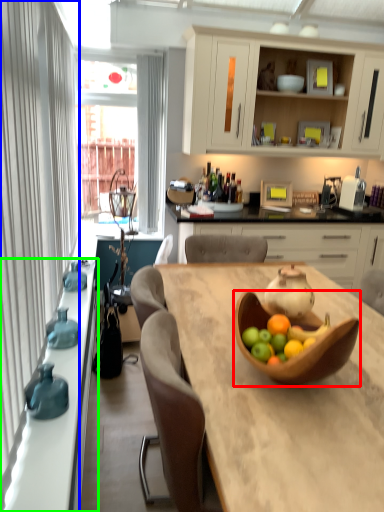
Question: Which is nearer to the tableware (highlighted by a red box)? curtain (highlighted by a blue box) or countertop (highlighted by a green box).

Choices:
 (A) curtain
 (B) countertop

Answer: (B)